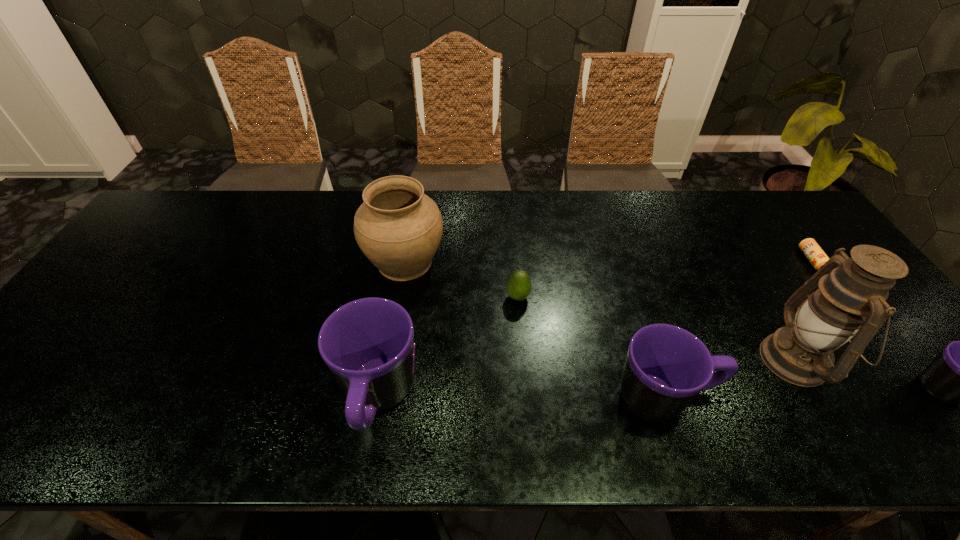
Please point a spot on the left to add another mug. Please provide its 2D coordinates. Your answer should be formatted as a tuple, i.e. [(x, y)], where the tuple contains the x and y coordinates of a point satisfying the conditions above.

[(93, 400)]